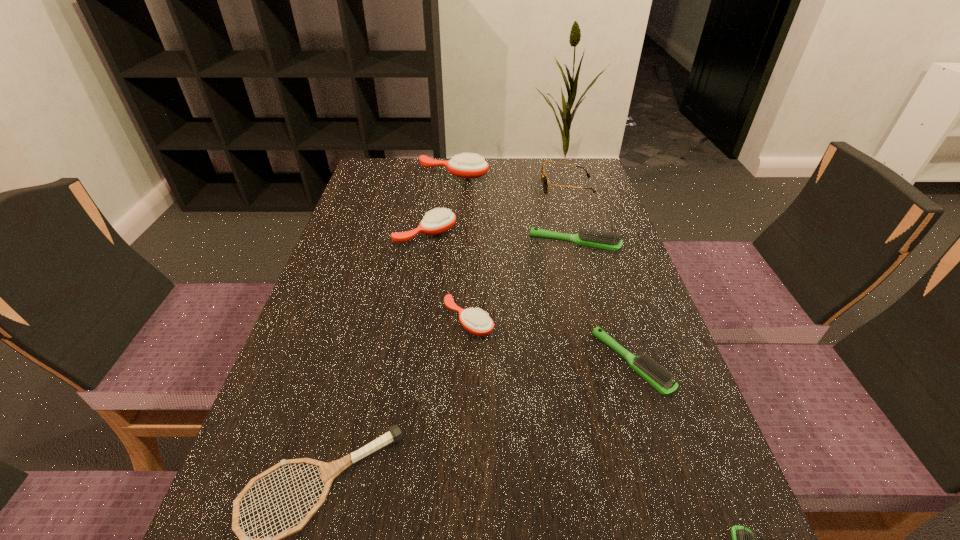
Identify which light hairbrush is the second closest to the gray tennis racket. Please provide its 2D coordinates. Your answer should be formatted as a tuple, i.e. [(x, y)], where the tuple contains the x and y coordinates of a point satisfying the conditions above.

[(742, 538)]

You are a GUI agent. You are given a task and a screenshot of the screen. Output one action in this format:
    pyautogui.click(x=<x>, y=<y>)
    Task: Click on the light hairbrush that stands as the second closest to the biggest light hairbrush
    The image size is (960, 540).
    Given the screenshot: What is the action you would take?
    pyautogui.click(x=742, y=538)

This screenshot has width=960, height=540. Find the location of `blank area in the image that satisfies the following two spatial constraints: 1. on the front-facing side of the sunglasses; 2. on the front side of the biggest light hairbrush`. blank area in the image that satisfies the following two spatial constraints: 1. on the front-facing side of the sunglasses; 2. on the front side of the biggest light hairbrush is located at coordinates (584, 244).

Where is `free spot that satisfies the following two spatial constraints: 1. on the front-facing side of the black sunglasses; 2. on the front side of the nearest orange hairbrush`? The height and width of the screenshot is (540, 960). free spot that satisfies the following two spatial constraints: 1. on the front-facing side of the black sunglasses; 2. on the front side of the nearest orange hairbrush is located at coordinates (607, 320).

Where is `free space that satisfies the following two spatial constraints: 1. on the front-facing side of the black sunglasses; 2. on the front side of the biggest light hairbrush`? This screenshot has height=540, width=960. free space that satisfies the following two spatial constraints: 1. on the front-facing side of the black sunglasses; 2. on the front side of the biggest light hairbrush is located at coordinates (584, 244).